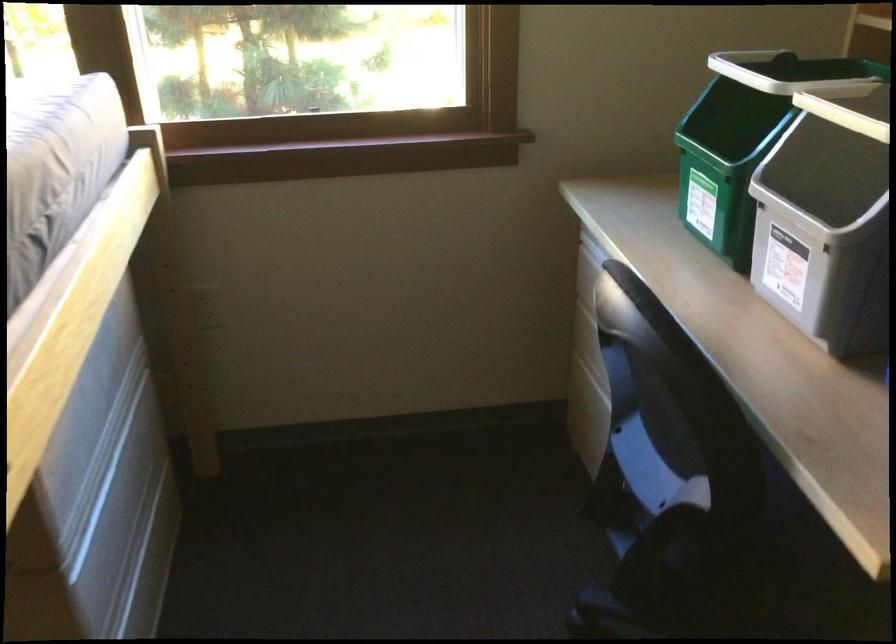
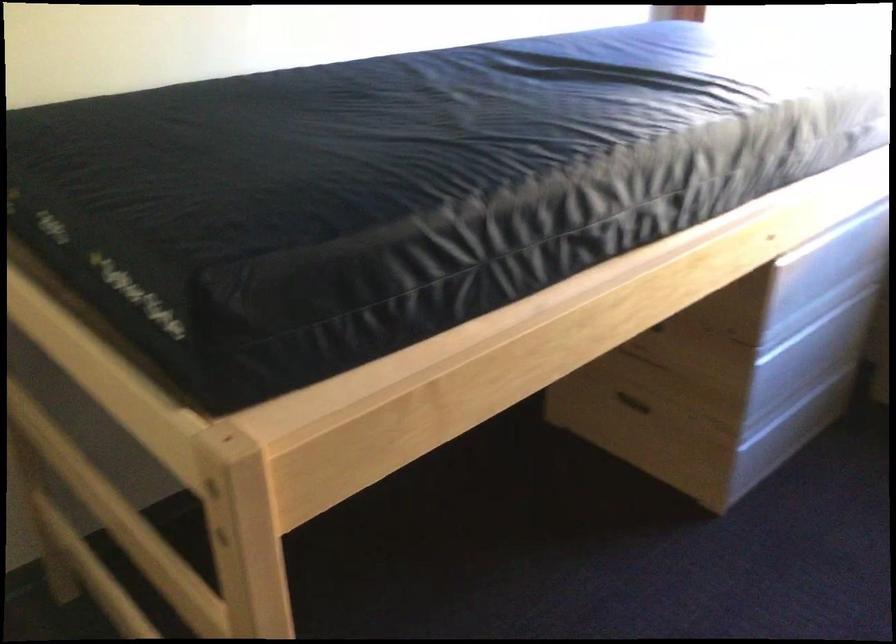
Question: The images are taken continuously from a first-person perspective. In which direction is your viewpoint rotating?

Choices:
 (A) Left
 (B) Right
 (C) Up
 (D) Down

Answer: (A)